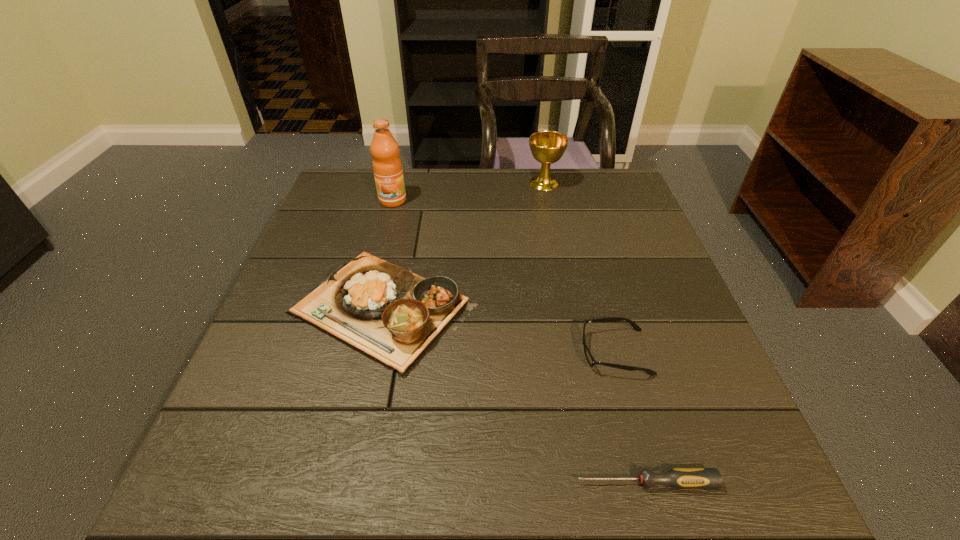
Find the location of a particular element. free space at the far right corner of the desktop is located at coordinates (583, 192).

Identify the location of vacant region between the third shortest object and the chalice. (463, 247).

The width and height of the screenshot is (960, 540). In order to click on vacant area that lies between the fruit juice and the fourth shortest object in this screenshot , I will do `click(468, 192)`.

I want to click on blank region between the fruit juice and the third shortest object, so click(388, 255).

Identify the location of free spot between the second farthest object and the screwdriver. (519, 342).

At what (x,y) coordinates should I click in order to perform the action: click on free space between the nearest object and the chalice. Please return your answer as a coordinate pair (x, y). This screenshot has width=960, height=540. Looking at the image, I should click on (594, 333).

The width and height of the screenshot is (960, 540). What are the coordinates of `free space between the spectacles and the third tallest object` in the screenshot? It's located at (498, 331).

Identify the location of free space between the chalice and the second farthest object. The image size is (960, 540). (468, 192).

This screenshot has width=960, height=540. Find the location of `vacant area that lies between the fourth tallest object and the fruit juice`. vacant area that lies between the fourth tallest object and the fruit juice is located at coordinates (504, 276).

You are a GUI agent. You are given a task and a screenshot of the screen. Output one action in this format:
    pyautogui.click(x=<x>, y=<y>)
    Task: Click on the vacant space that's between the second farthest object and the second shortest object
    The height and width of the screenshot is (540, 960).
    Given the screenshot: What is the action you would take?
    pyautogui.click(x=504, y=276)